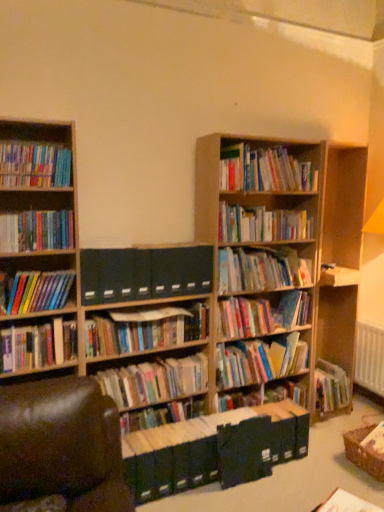
Question: From the image's perspective, is hardcover books at center, the 15th book in the top-to-bottom sequence, above or below hardcover books at center, the 10th book viewed from the top?

Choices:
 (A) above
 (B) below

Answer: (B)

Question: Is hardcover books at center, the 2th book in the bottom-to-top sequence, bigger or smaller than hardcover books at center, which is the 7th book in bottom-to-top order?

Choices:
 (A) small
 (B) big

Answer: (A)

Question: Which object is the farthest from the white paper at lower right, acting as the fourteenth book starting from the top?

Choices:
 (A) hardcover books at center, the 2th book in the bottom-to-top sequence
 (B) hardcover books at upper center, which ranks as the first book in top-to-bottom order
 (C) hardcover books at center, which appears as the 14th book when ordered from the bottom
 (D) multicolored paperbacks at center, the fifth book in the top-to-bottom sequence
 (E) hardcover books at left, the 11th book positioned from the top

Answer: (B)

Question: Estimate the real-world distances between objects in this image. Which object is farther from the white paper at lower right, which is the third book in bottom-to-top order?

Choices:
 (A) hardcover books at center, which is the 7th book in bottom-to-top order
 (B) hardcover books at upper center, the 16th book ordered from the bottom
 (C) hardcover books at left, which ranks as the 8th book in top-to-bottom order
 (D) hardcover books at center, the ninth book in the top-to-bottom sequence
 (E) dark blue file folders at center, the 11th book in the bottom-to-top sequence

Answer: (B)